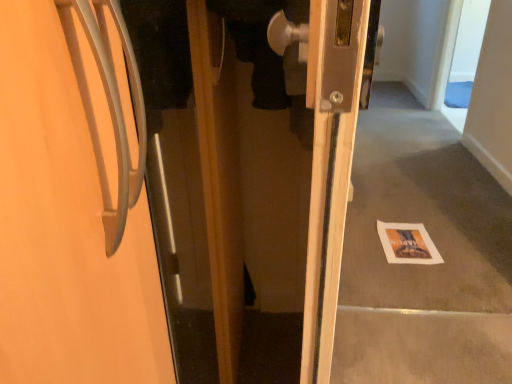
Question: Does point (155, 258) appear closer or farther from the camera than point (391, 248)?

Choices:
 (A) closer
 (B) farther

Answer: (A)

Question: From a real-world perspective, is matte silver door at center positioned above or below white paper at lower right?

Choices:
 (A) above
 (B) below

Answer: (A)

Question: In the image, is matte silver door at center positioned in front of or behind white paper at lower right?

Choices:
 (A) front
 (B) behind

Answer: (A)

Question: Is point (423, 231) positioned closer to the camera than point (97, 122)?

Choices:
 (A) farther
 (B) closer

Answer: (A)

Question: From the image's perspective, is white paper at lower right located above or below matte silver door at center?

Choices:
 (A) below
 (B) above

Answer: (A)

Question: From their relative heights in the image, would you say white paper at lower right is taller or shorter than matte silver door at center?

Choices:
 (A) tall
 (B) short

Answer: (B)

Question: In the image, is white paper at lower right positioned in front of or behind matte silver door at center?

Choices:
 (A) behind
 (B) front

Answer: (A)